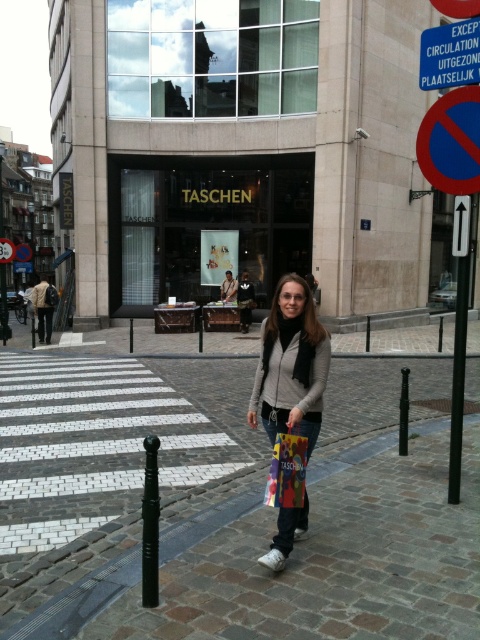
From the picture: Can you confirm if blue plastic sign at upper center is positioned below white plastic arrow at upper right?

Actually, blue plastic sign at upper center is above white plastic arrow at upper right.

Where is `blue plastic sign at upper center`? blue plastic sign at upper center is located at coordinates (450, 54).

Who is more distant from viewer, (459, 44) or (469, 209)?

The point (459, 44) is behind.

Locate an element on the screen. blue plastic sign at upper center is located at coordinates (450, 54).

Between black plastic pole at center and black metal pole at center, which one has less height?

black metal pole at center

How much distance is there between black plastic pole at center and black metal pole at center?

They are 10.81 feet apart.

Between point (144, 554) and point (407, 435), which one is positioned behind?

The point (407, 435) is more distant.

Locate an element on the screen. black plastic pole at center is located at coordinates (149, 524).

Is point (284, 506) in front of point (399, 452)?

Yes.

Is point (268, 500) more distant than point (404, 412)?

No, it is in front of (404, 412).

The height and width of the screenshot is (640, 480). I want to click on multicolored fabric shopping bag at center, so click(287, 470).